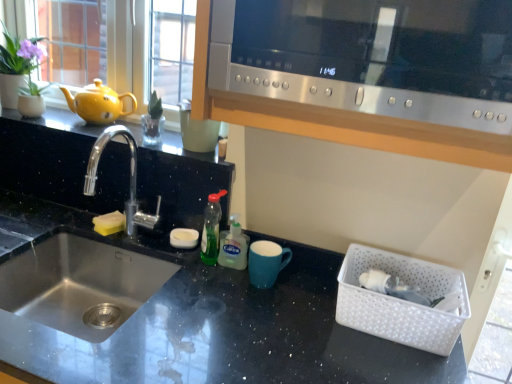
At what (x,y) coordinates should I click in order to perform the action: click on vacant space to the right of green translucent soap dispenser at center, which appears as the 2th bottle when viewed from the left. Please return your answer as a coordinate pair (x, y). Image resolution: width=512 pixels, height=384 pixels. Looking at the image, I should click on (303, 286).